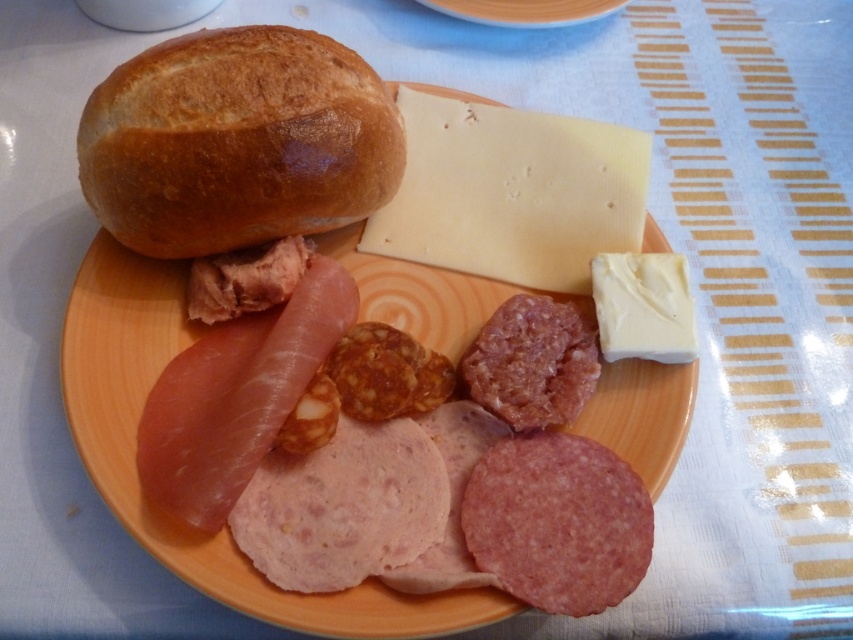
Where is the golden brown crusty bun at upper left located in the image?

The golden brown crusty bun at upper left is located at point (x=236, y=141).

You are a food stylist arranging items on the orange matte plate at center. You want to ensure the pink textured salami at center doesn not block the view of the plate. Is the salami too tall for this requirement?

The pink textured salami at center is taller than the orange matte plate at center, so it will block the view of the plate.

You are a chef arranging a charcuterie board and need to place the golden brown crusty bun at upper left and the white creamy cheese at upper right. Based on their positions, which item is closer to the left edge of the plate?

The golden brown crusty bun at upper left is closer to the left edge of the plate since it is positioned to the left of the white creamy cheese at upper right.